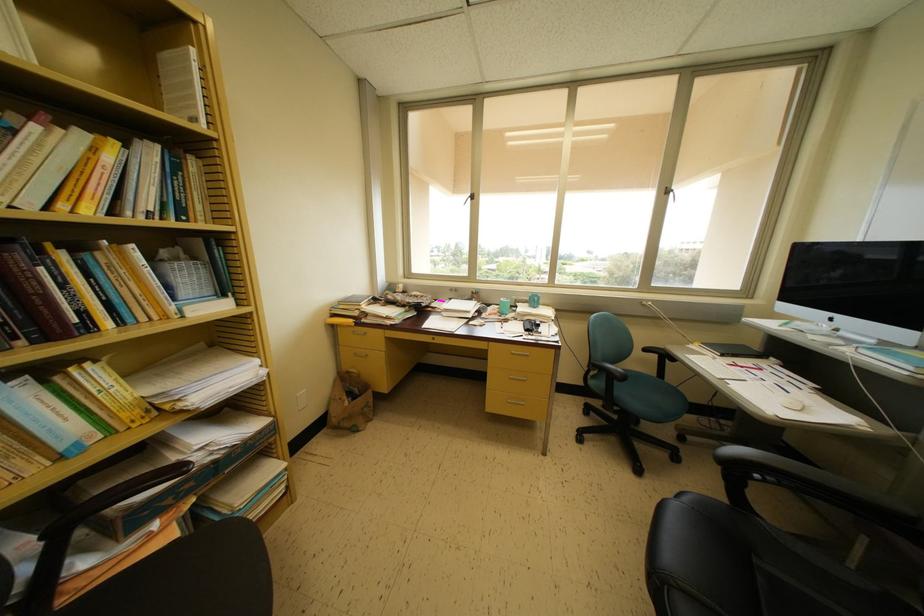
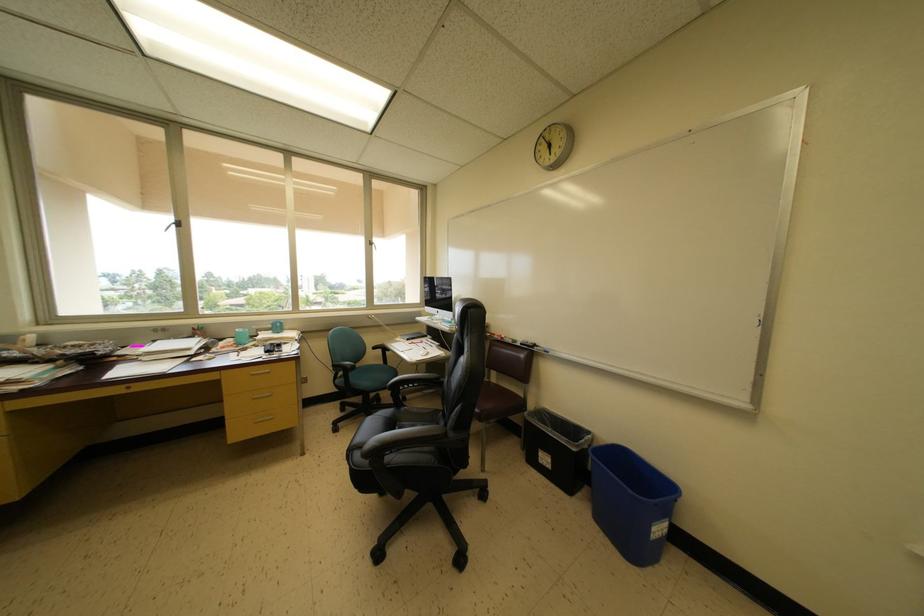
Question: The camera is either moving clockwise (left) or counter-clockwise (right) around the object. The first image is from the beginning of the video and the second image is from the end. Is the camera moving left or right when shooting the video?

Choices:
 (A) Left
 (B) Right

Answer: (A)